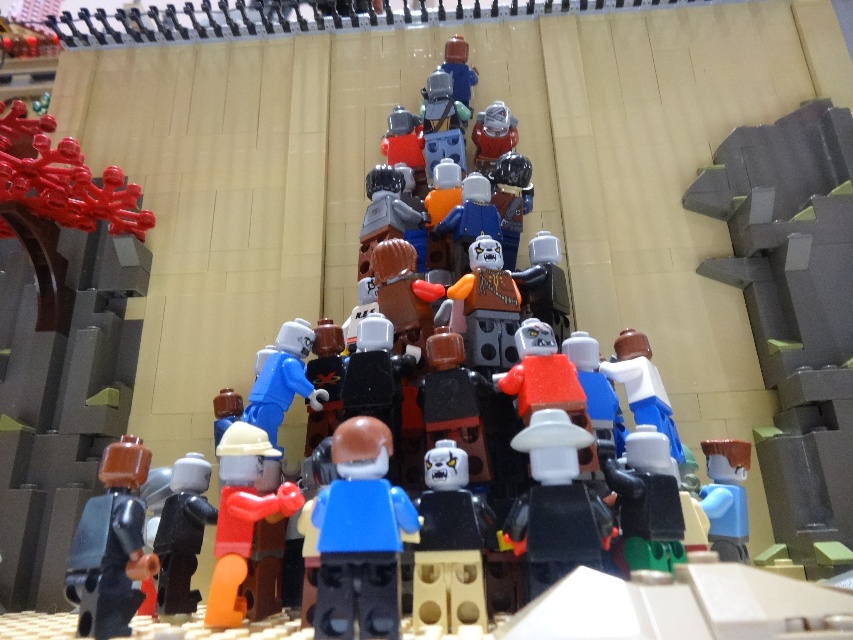
You are a LEGO enthusiast trying to recreate this scene. You have a 24 inch long LEGO baseplate. If you place the blue plastic figure at center and the black matte minifigure at lower left exactly as shown, will they fit within the baseplate without overlapping?

The distance between the blue plastic figure at center and the black matte minifigure at lower left is 20.69 inches. Since the baseplate is 24 inches long, they will fit within the baseplate without overlapping as there is enough space.

You are a LEGO enthusiast trying to fit a new display case that requires all figures to be within a 10 cm width limit. Given the blue plastic figure at center and the black matte minifigure at lower left, which one might exceed the width limit?

The blue plastic figure at center has a greater width than the black matte minifigure at lower left, so it might exceed the 10 cm width limit.